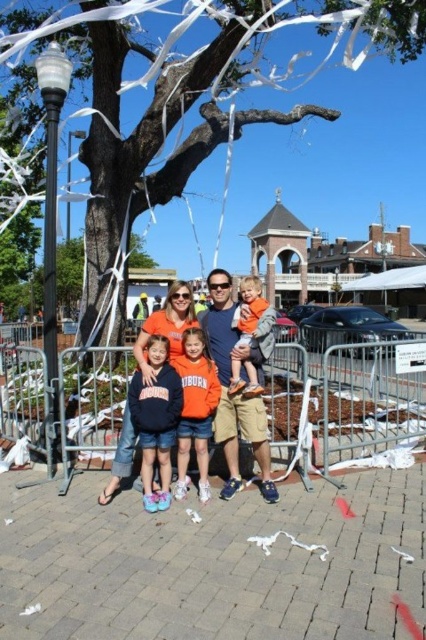
Consider the image. You are a photographer setting up for a family photo. You notice the white glossy lamp post at left and the black metal pole at left in the background. Which object should you adjust your camera angle to avoid blocking the family? Explain why.

You should adjust your camera angle to avoid blocking the white glossy lamp post at left because it is above the black metal pole at left, making it more likely to appear in the foreground and obstruct the family in the photo.

You are a photographer setting up for a family photo. You notice the white glossy lamp post at left and the black metal pole at left in the background. Which object should you adjust your camera angle to avoid blocking the family members?

The black metal pole at left is larger in size compared to the white glossy lamp post at left, so you should adjust your camera angle to avoid blocking the family members with the black metal pole at left.